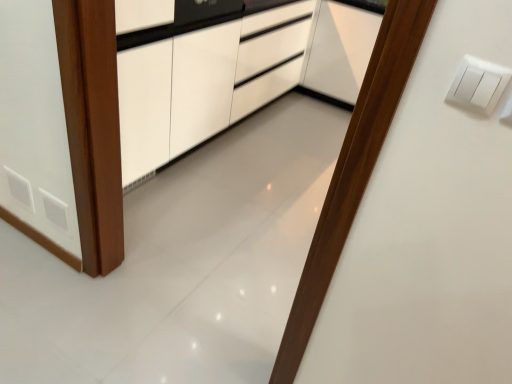
Question: Considering the positions of white glossy cabinet at center and white plastic light switch at upper right in the image, is white glossy cabinet at center taller or shorter than white plastic light switch at upper right?

Choices:
 (A) tall
 (B) short

Answer: (A)

Question: In terms of size, does white glossy cabinet at center appear bigger or smaller than white plastic light switch at upper right?

Choices:
 (A) big
 (B) small

Answer: (A)

Question: From a real-world perspective, is white glossy cabinet at center above or below white plastic light switch at upper right?

Choices:
 (A) below
 (B) above

Answer: (A)

Question: From the image's perspective, is white plastic light switch at upper right located above or below white glossy cabinet at center?

Choices:
 (A) below
 (B) above

Answer: (A)

Question: Considering the positions of point (453, 102) and point (165, 147), is point (453, 102) closer or farther from the camera than point (165, 147)?

Choices:
 (A) closer
 (B) farther

Answer: (A)

Question: In terms of height, does white plastic light switch at upper right look taller or shorter compared to white glossy cabinet at center?

Choices:
 (A) short
 (B) tall

Answer: (A)

Question: Looking at the image, does white plastic light switch at upper right seem bigger or smaller compared to white glossy cabinet at center?

Choices:
 (A) small
 (B) big

Answer: (A)